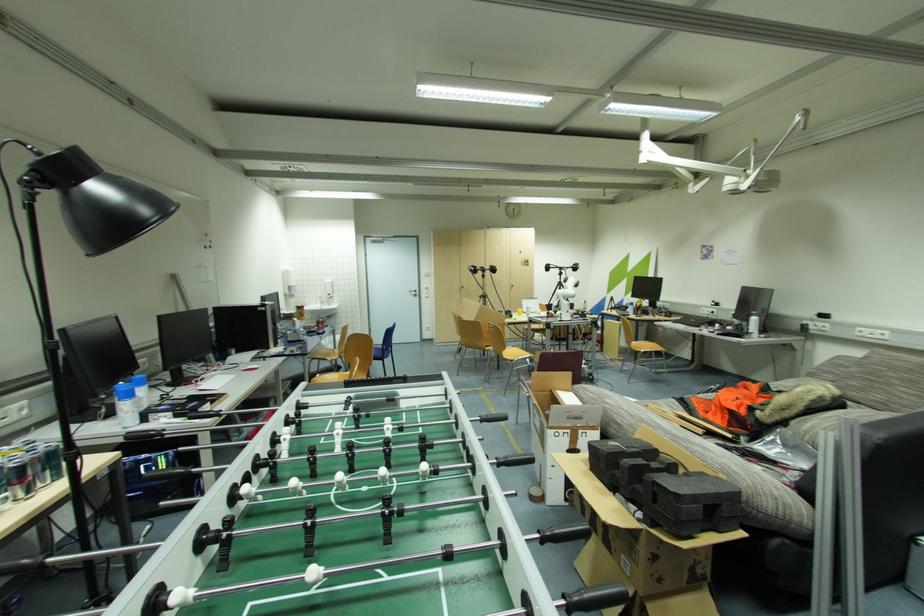
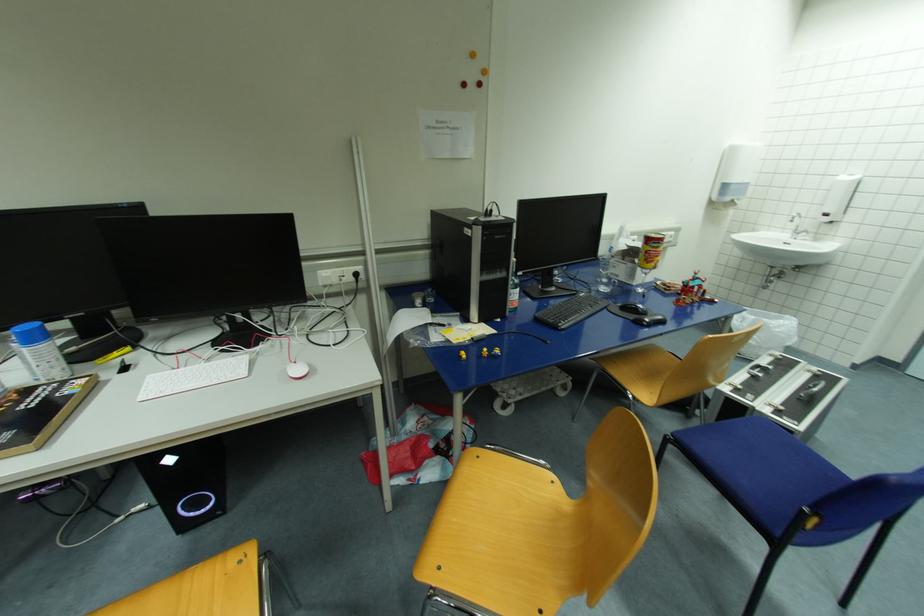
Find the pixel in the second image that matches the point at 325,304 in the first image.

(799, 233)